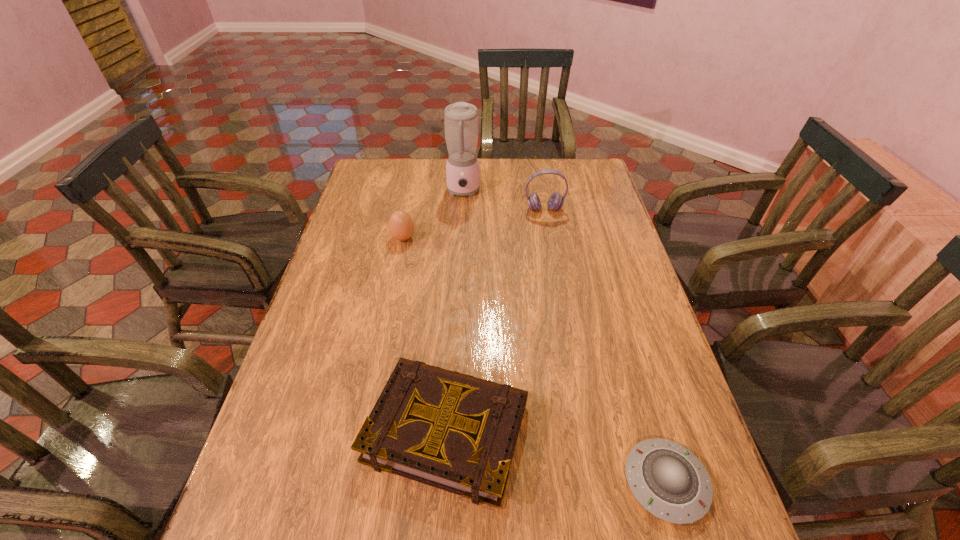
Where is `vacant space located 0.330m on the right of the boiled egg`? vacant space located 0.330m on the right of the boiled egg is located at coordinates (517, 238).

This screenshot has height=540, width=960. What are the coordinates of `vacant space located on the left of the hardback book` in the screenshot? It's located at (294, 430).

Where is `vacant space situated 0.320m on the left of the shortest object`? vacant space situated 0.320m on the left of the shortest object is located at coordinates (464, 482).

The height and width of the screenshot is (540, 960). What are the coordinates of `object that is positioned at the far edge` in the screenshot? It's located at (460, 119).

Image resolution: width=960 pixels, height=540 pixels. What are the coordinates of `object located in the right edge section of the desktop` in the screenshot? It's located at (668, 480).

In the image, there is a desktop. Where is `blank space at the far edge`? Image resolution: width=960 pixels, height=540 pixels. blank space at the far edge is located at coordinates (426, 162).

The height and width of the screenshot is (540, 960). Find the location of `free space at the left edge of the desktop`. free space at the left edge of the desktop is located at coordinates (332, 360).

Locate an element on the screen. The image size is (960, 540). vacant area at the right edge of the desktop is located at coordinates (639, 350).

This screenshot has width=960, height=540. What are the coordinates of `free space at the far right corner` in the screenshot? It's located at (573, 180).

At what (x,y) coordinates should I click in order to perform the action: click on unoccupied area between the second tallest object and the shortest object. Please return your answer as a coordinate pair (x, y). The width and height of the screenshot is (960, 540). Looking at the image, I should click on (605, 346).